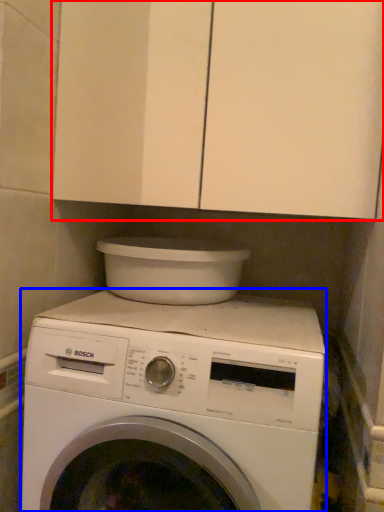
Question: Which object is further to the camera taking this photo, cabinetry (highlighted by a red box) or washing machine (highlighted by a blue box)?

Choices:
 (A) cabinetry
 (B) washing machine

Answer: (A)